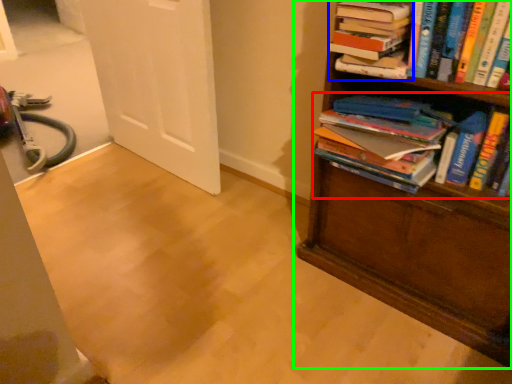
Question: Which object is positioned closest to book (highlighted by a red box)? Select from book (highlighted by a blue box) and bookcase (highlighted by a green box).

Choices:
 (A) book
 (B) bookcase

Answer: (B)